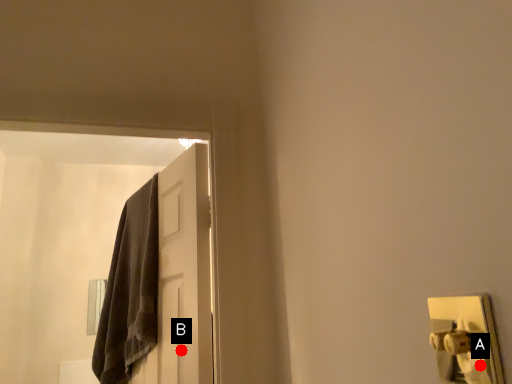
Question: Two points are circled on the image, labeled by A and B beside each circle. Which of the following is the farthest from the observer?

Choices:
 (A) A is further
 (B) B is further

Answer: (A)